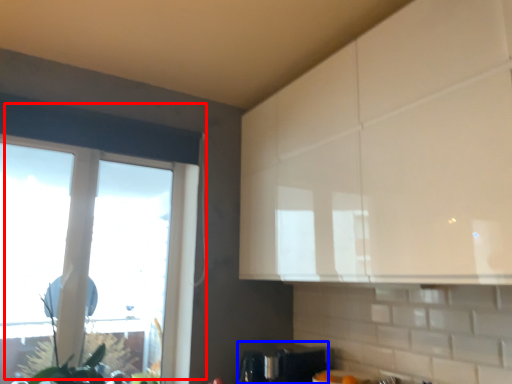
Question: Among these objects, which one is farthest to the camera, window (highlighted by a red box) or appliance (highlighted by a blue box)?

Choices:
 (A) window
 (B) appliance

Answer: (B)